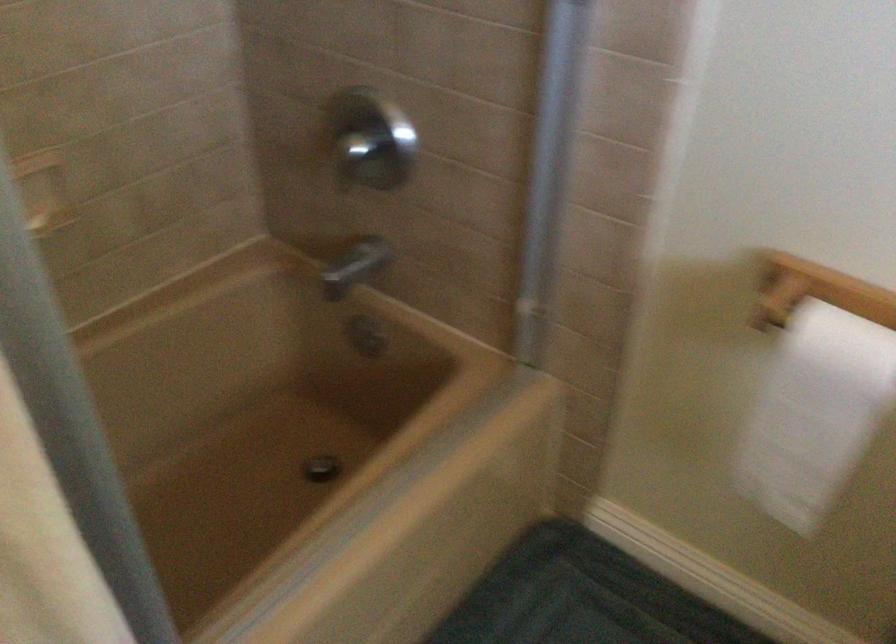
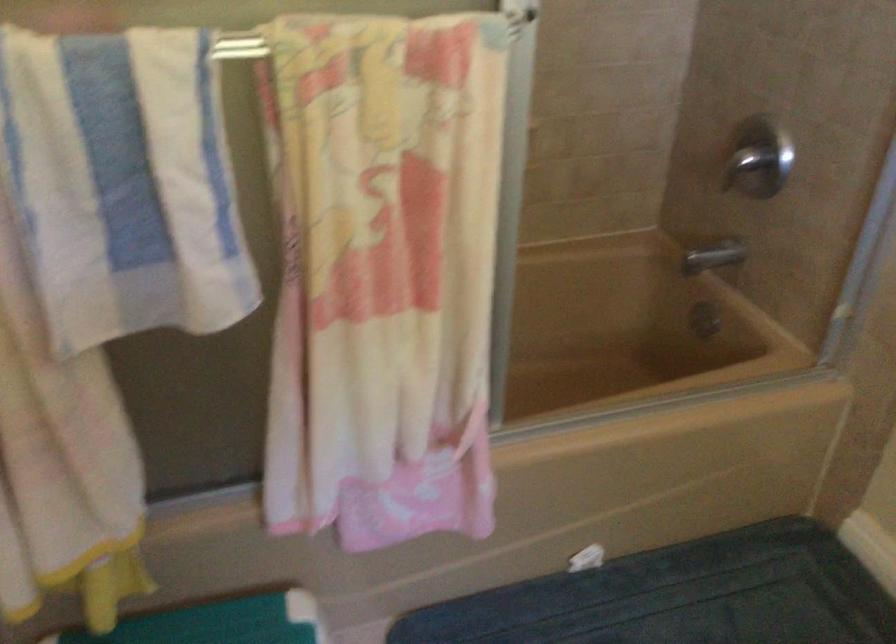
Question: How did the camera likely rotate?

Choices:
 (A) Left
 (B) Right
 (C) Up
 (D) Down

Answer: (A)